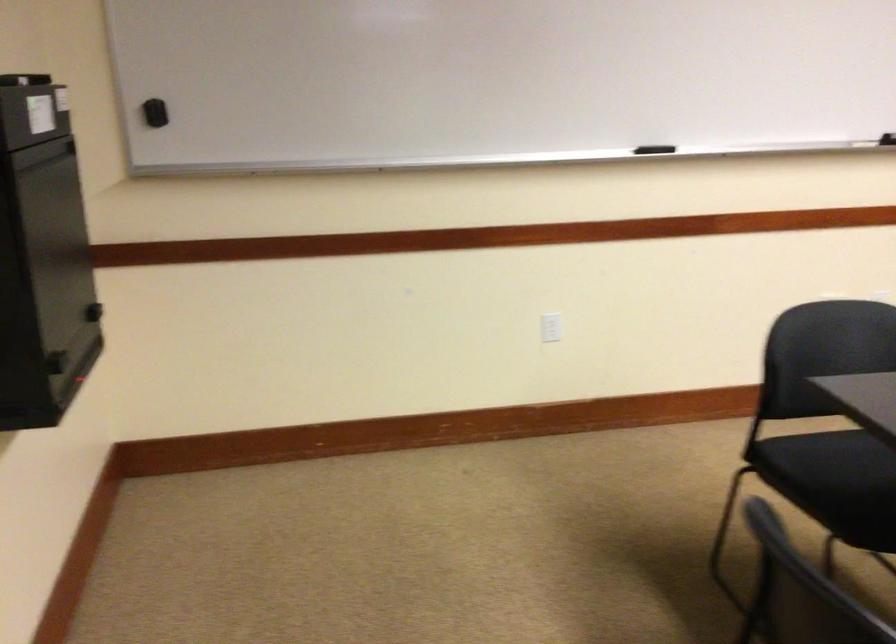
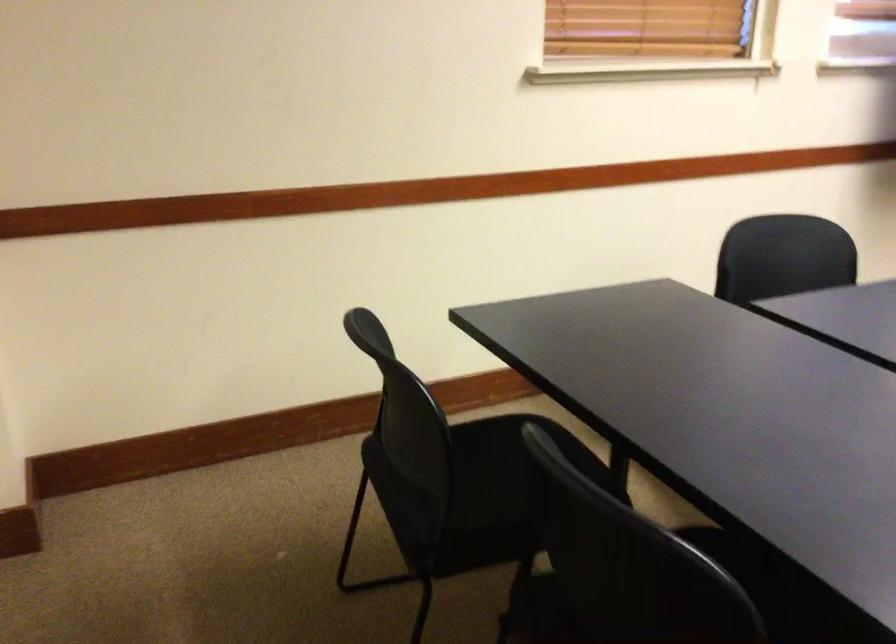
First-person continuous shooting, in which direction is the camera rotating?

The camera's rotation is toward right-down.